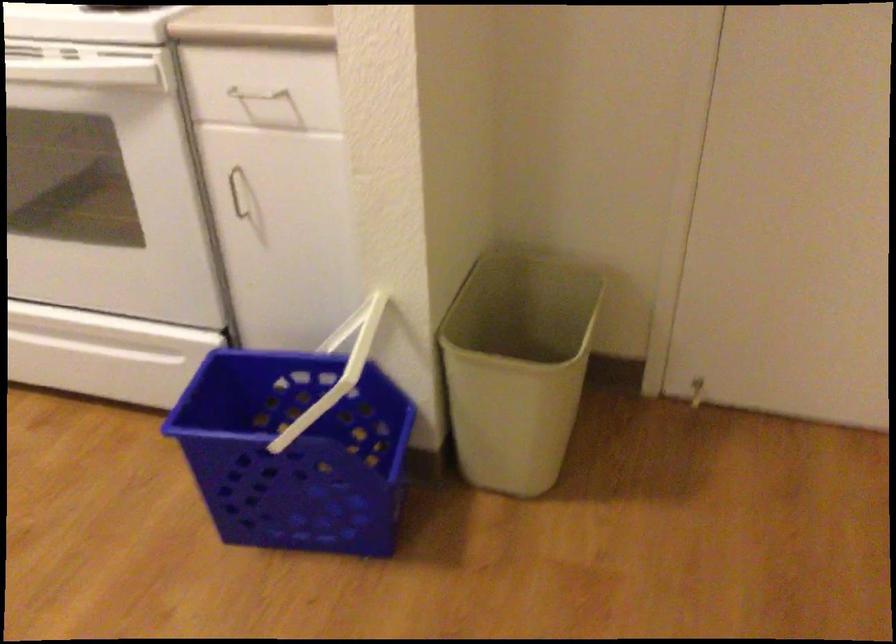
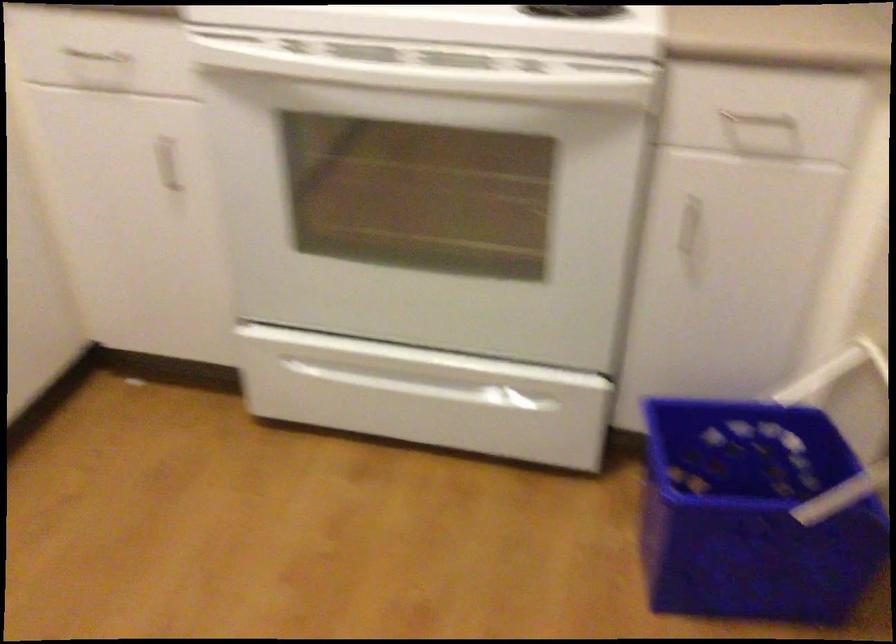
Locate, in the second image, the point that corresponds to point (92, 339) in the first image.

(435, 379)